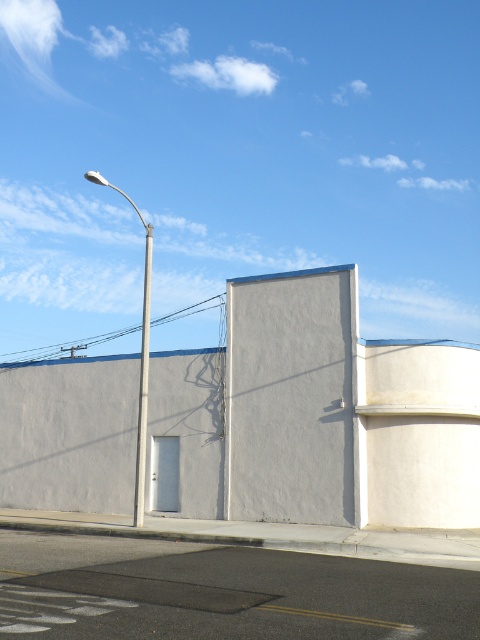
You are a city planner assessing the placement of poles in the urban scene. Given the presence of both the metallic pole at left and the smooth silver pole at center, which one is taller?

The metallic pole at left is taller than the smooth silver pole at center.

You are a city planner reviewing this urban layout. You need to determine the placement of new street signs. Given the positions of the metallic pole at left and the smooth silver pole at center, which pole is closer to the left edge of the image?

The metallic pole at left is closer to the left edge of the image because it is positioned to the left of the smooth silver pole at center.

You are a city planner assessing the placement of poles in the urban scene. Given the presence of both the metallic pole at left and the smooth silver pole at center, which pole would require a wider base to ensure stability?

The metallic pole at left might require a wider base than the smooth silver pole at center to ensure stability since it is wider.